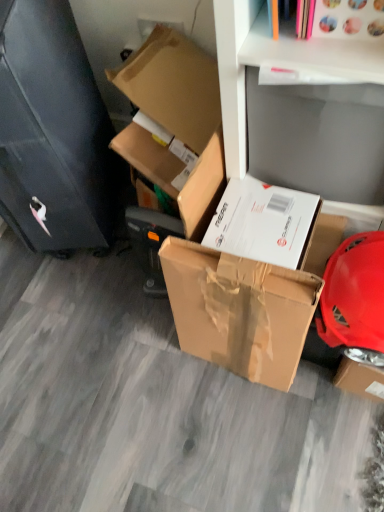
Question: Considering their positions, is white matte shelf at upper center located in front of or behind black matte file cabinet at left?

Choices:
 (A) front
 (B) behind

Answer: (A)

Question: From a real-world perspective, is white matte shelf at upper center physically located above or below black matte file cabinet at left?

Choices:
 (A) above
 (B) below

Answer: (A)

Question: Which object is positioned farthest from the brown cardboard box at upper left, which ranks as the 1th box in top-to-bottom order?

Choices:
 (A) brown cardboard box at center, which is the 1th box in bottom-to-top order
 (B) black matte file cabinet at left
 (C) white matte shelf at upper center

Answer: (A)

Question: Estimate the real-world distances between objects in this image. Which object is closer to the brown cardboard box at center, the second box in the top-to-bottom sequence?

Choices:
 (A) brown cardboard box at upper left, which ranks as the 1th box in top-to-bottom order
 (B) black matte file cabinet at left
 (C) white matte shelf at upper center

Answer: (C)